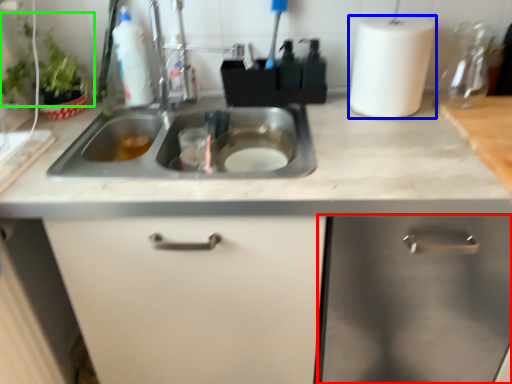
Question: Which object is the farthest from cabinetry (highlighted by a red box)? Choose among these: paper towel (highlighted by a blue box) or plant (highlighted by a green box).

Choices:
 (A) paper towel
 (B) plant

Answer: (B)